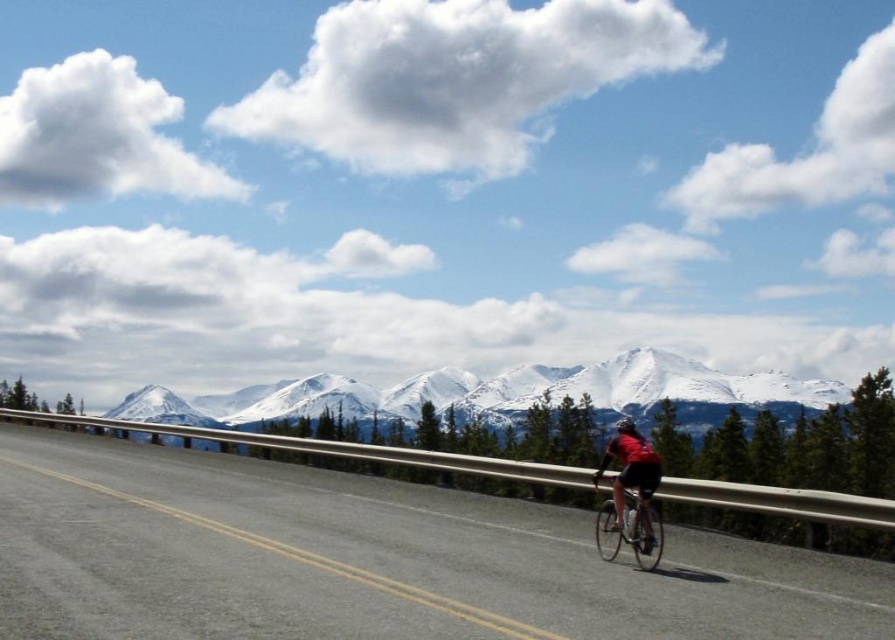
Between black asphalt road at center and snowy granite mountains at upper center, which one has less height?

black asphalt road at center

Identify the location of black asphalt road at center. This screenshot has width=895, height=640. (368, 560).

You are a GUI agent. You are given a task and a screenshot of the screen. Output one action in this format:
    pyautogui.click(x=<x>, y=<y>)
    Task: Click on the black asphalt road at center
    The width and height of the screenshot is (895, 640).
    Given the screenshot: What is the action you would take?
    pyautogui.click(x=368, y=560)

Is snowy granite mountains at upper center closer to the viewer compared to red fabric cyclist at center?

No, snowy granite mountains at upper center is behind red fabric cyclist at center.

Can you confirm if snowy granite mountains at upper center is positioned to the right of red fabric cyclist at center?

No, snowy granite mountains at upper center is not to the right of red fabric cyclist at center.

Between point (665, 394) and point (637, 436), which one is positioned behind?

The point (665, 394) is behind.

Find the location of a particular element. The height and width of the screenshot is (640, 895). snowy granite mountains at upper center is located at coordinates [497, 394].

Consider the image. Is snowy granite mountains at upper center bigger than shiny black helmet at center?

Correct, snowy granite mountains at upper center is larger in size than shiny black helmet at center.

Identify the location of snowy granite mountains at upper center. (497, 394).